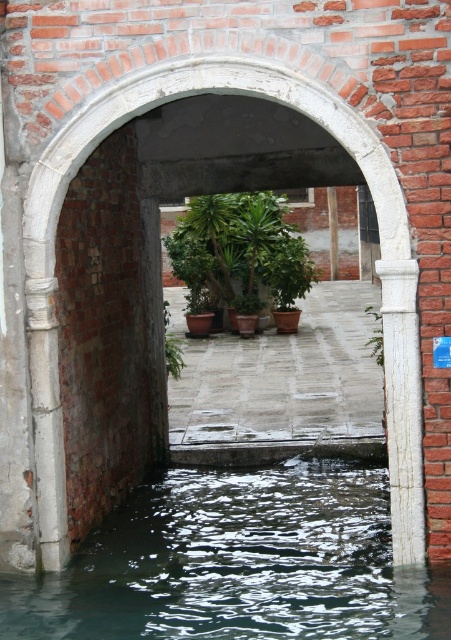
Question: Which of the following is the farthest from the observer?

Choices:
 (A) (248, 209)
 (B) (164, 550)
 (C) (373, 317)
 (D) (420, 428)

Answer: (C)

Question: Based on their relative distances, which object is farther from the dark green water at center?

Choices:
 (A) white marble pillar at right
 (B) green matte plant at center

Answer: (B)

Question: Considering the relative positions of green matte plant at center and white marble pillar at right in the image provided, where is green matte plant at center located with respect to white marble pillar at right?

Choices:
 (A) below
 (B) above

Answer: (B)

Question: Which point is farther to the camera?

Choices:
 (A) (419, 408)
 (B) (372, 308)
 (C) (248, 550)

Answer: (B)

Question: Observing the image, what is the correct spatial positioning of dark green water at center in reference to white marble pillar at right?

Choices:
 (A) above
 (B) below

Answer: (B)

Question: Does green matte plant at center have a lesser width compared to green leafy plant at center?

Choices:
 (A) no
 (B) yes

Answer: (A)